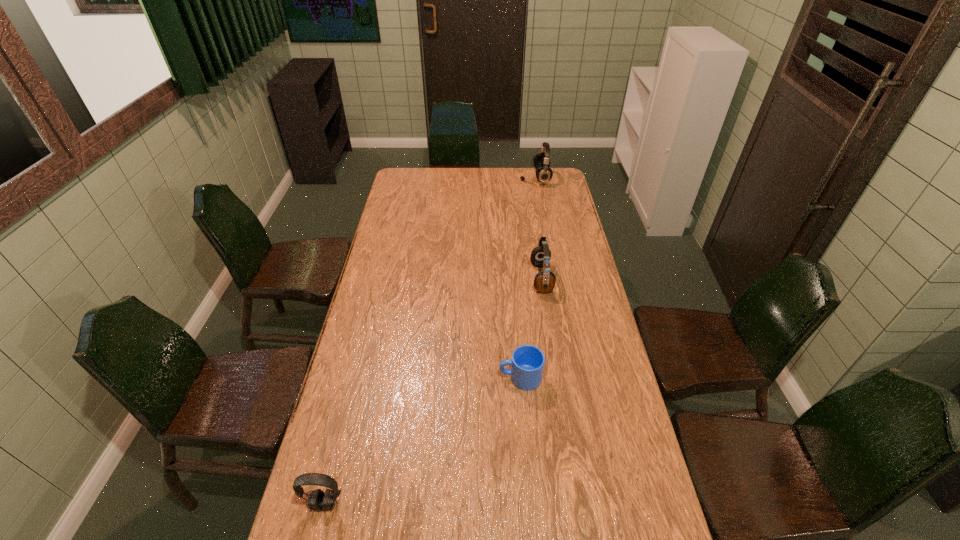
Point out which headset is positioned as the second nearest to the farthest object. Please provide its 2D coordinates. Your answer should be formatted as a tuple, i.e. [(x, y)], where the tuple contains the x and y coordinates of a point satisfying the conditions above.

[(318, 500)]

The height and width of the screenshot is (540, 960). What are the coordinates of `free space that satisfies the following two spatial constraints: 1. with the microphone on the side of the farthest headset; 2. on the front-facing side of the nearest object` in the screenshot? It's located at (595, 503).

Locate an element on the screen. This screenshot has height=540, width=960. free spot that satisfies the following two spatial constraints: 1. on the ear cups of the third nearest object; 2. on the front-facing side of the leftmost object is located at coordinates (576, 503).

This screenshot has height=540, width=960. I want to click on free space that satisfies the following two spatial constraints: 1. on the side of the third farthest object with the handle; 2. on the front-facing side of the shortest headset, so click(531, 503).

This screenshot has width=960, height=540. What are the coordinates of `vacant area that satisfies the following two spatial constraints: 1. on the ear cups of the second farthest headset; 2. on the front-facing side of the shortest headset` in the screenshot? It's located at [576, 503].